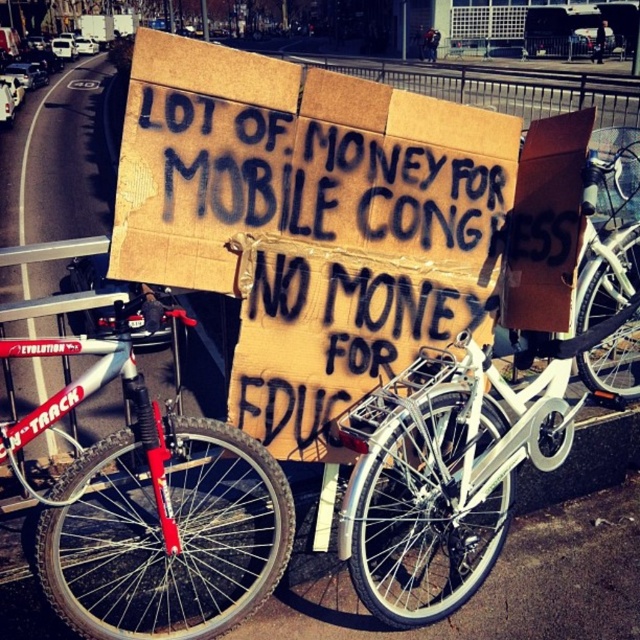
You are a photographer standing in front of the red matte bicycle at left and the cardboard sign at center. You want to take a photo that includes both objects in focus. Which object should you focus on to ensure both are sharp?

You should focus on the cardboard sign at center because it is closer to you than the red matte bicycle at left, so focusing on the closer object will keep both in focus.